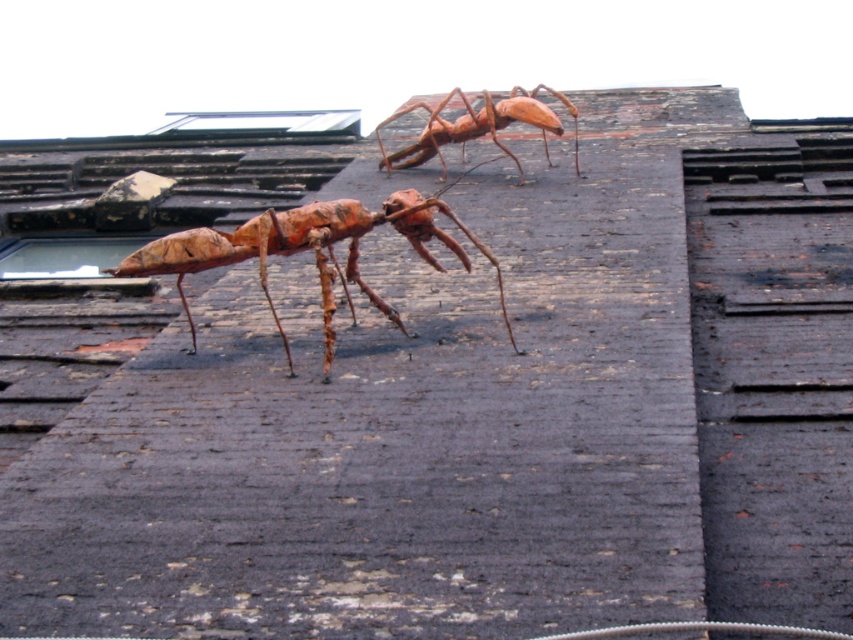
Between rustic wood insect at center and rustic wood ant at upper center, which one has less height?

Standing shorter between the two is rustic wood insect at center.

Does rustic wood insect at center have a lesser width compared to rustic wood ant at upper center?

Incorrect, rustic wood insect at center's width is not less than rustic wood ant at upper center's.

The image size is (853, 640). What are the coordinates of `rustic wood insect at center` in the screenshot? It's located at [x=306, y=248].